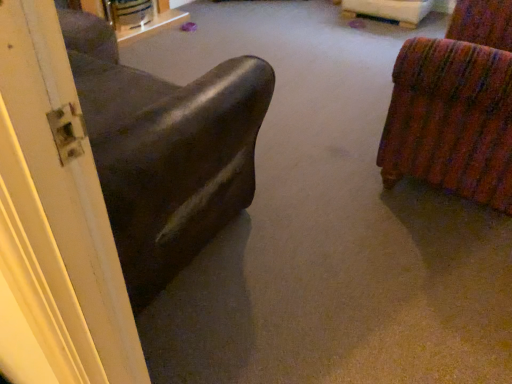
Identify the location of matte black chair at left. (166, 150).

What do you see at coordinates (166, 150) in the screenshot?
I see `matte black chair at left` at bounding box center [166, 150].

The height and width of the screenshot is (384, 512). Find the location of `matte black chair at left`. matte black chair at left is located at coordinates (166, 150).